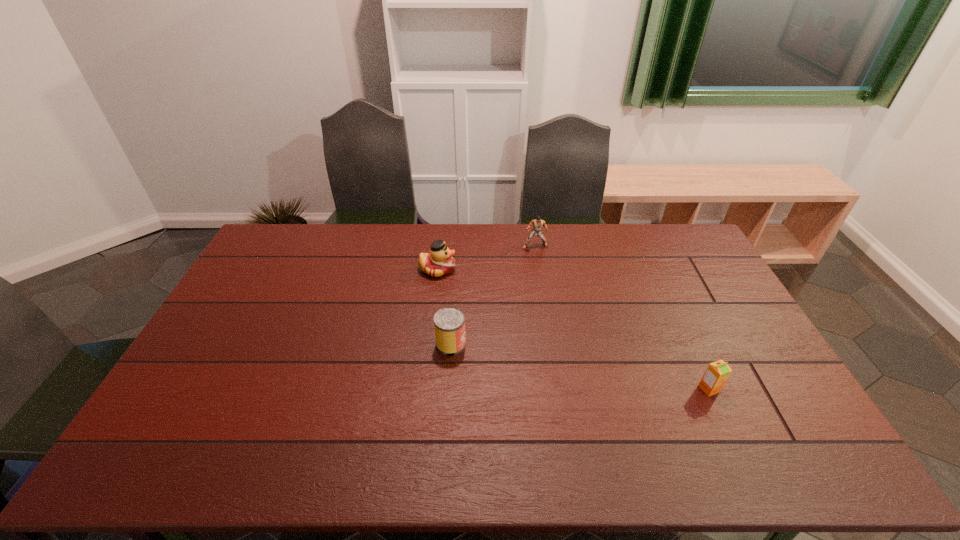
Locate an element on the screen. The image size is (960, 540). puncher that is at the far edge is located at coordinates (537, 224).

You are a GUI agent. You are given a task and a screenshot of the screen. Output one action in this format:
    pyautogui.click(x=<x>, y=<y>)
    Task: Click on the duck located in the far edge section of the desktop
    
    Given the screenshot: What is the action you would take?
    pyautogui.click(x=439, y=262)

The image size is (960, 540). In the image, there is a desktop. Find the location of `vacant space at the far edge`. vacant space at the far edge is located at coordinates (464, 243).

The image size is (960, 540). Identify the location of vacant space at the near edge of the desktop. (677, 471).

The height and width of the screenshot is (540, 960). In the image, there is a desktop. Find the location of `vacant space at the left edge`. vacant space at the left edge is located at coordinates (244, 295).

You are a GUI agent. You are given a task and a screenshot of the screen. Output one action in this format:
    pyautogui.click(x=<x>, y=<y>)
    Task: Click on the free spot at the right edge of the desktop
    The height and width of the screenshot is (540, 960).
    Given the screenshot: What is the action you would take?
    pyautogui.click(x=709, y=298)

In the image, there is a desktop. At what (x,y) coordinates should I click in order to perform the action: click on vacant space at the far left corner. Please return your answer as a coordinate pair (x, y). The height and width of the screenshot is (540, 960). Looking at the image, I should click on (280, 253).

Identify the location of vacant area at the far right corner. (656, 237).

This screenshot has width=960, height=540. Identify the location of vacant space at the near right corner of the desktop. (785, 463).

At what (x,y) coordinates should I click in order to perform the action: click on vacant area that lies between the third object from left to right and the third nearest object. Please return your answer as a coordinate pair (x, y). This screenshot has height=540, width=960. Looking at the image, I should click on (486, 258).